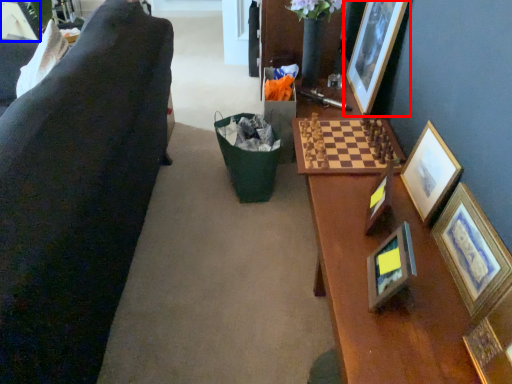
Question: Which of the following is the closest to the observer, picture frame (highlighted by a red box) or picture frame (highlighted by a blue box)?

Choices:
 (A) picture frame
 (B) picture frame

Answer: (A)